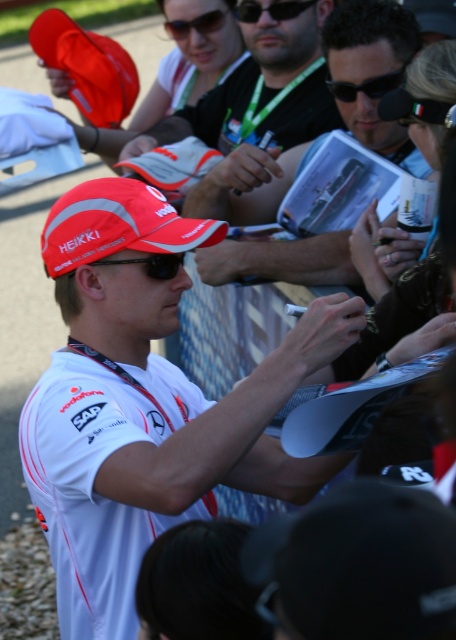
Can you confirm if white matte cap at center is positioned to the right of black plastic goggles at center?

No, white matte cap at center is not to the right of black plastic goggles at center.

Is white matte cap at center further to the viewer compared to black plastic goggles at center?

No, it is in front of black plastic goggles at center.

Identify the location of white matte cap at center. Image resolution: width=456 pixels, height=640 pixels. (262, 92).

Is red fabric cap at center below red reflective cap at center?

Incorrect, red fabric cap at center is not positioned below red reflective cap at center.

Where is `red fabric cap at center`? The image size is (456, 640). red fabric cap at center is located at coordinates (118, 225).

Does red fabric cap at center have a lesser height compared to black plastic goggles at center?

No.

Is red fabric cap at center in front of black plastic goggles at center?

That is True.

Between point (164, 225) and point (301, 10), which one is positioned in front?

Point (164, 225)

At what (x,y) coordinates should I click in order to perform the action: click on red fabric cap at center. Please return your answer as a coordinate pair (x, y). Looking at the image, I should click on (118, 225).